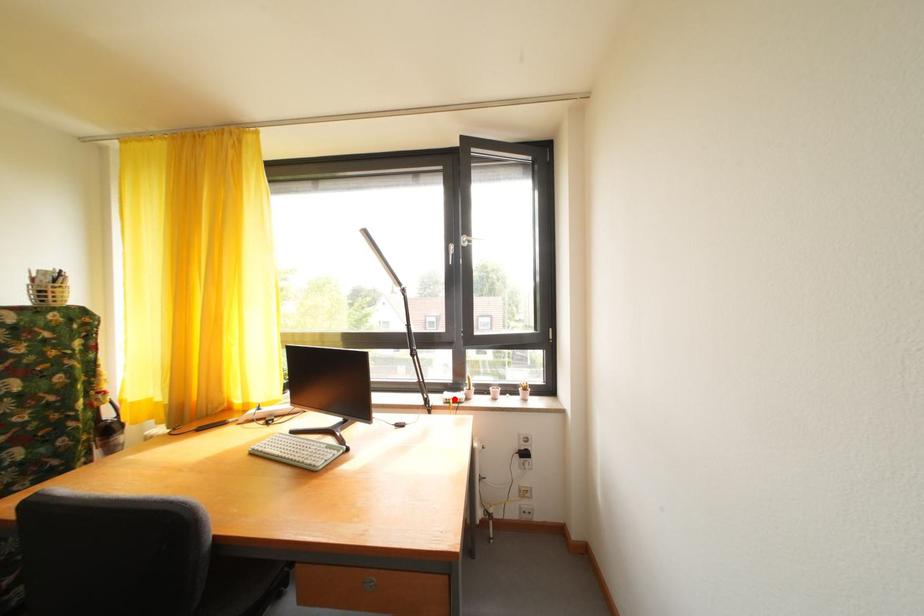
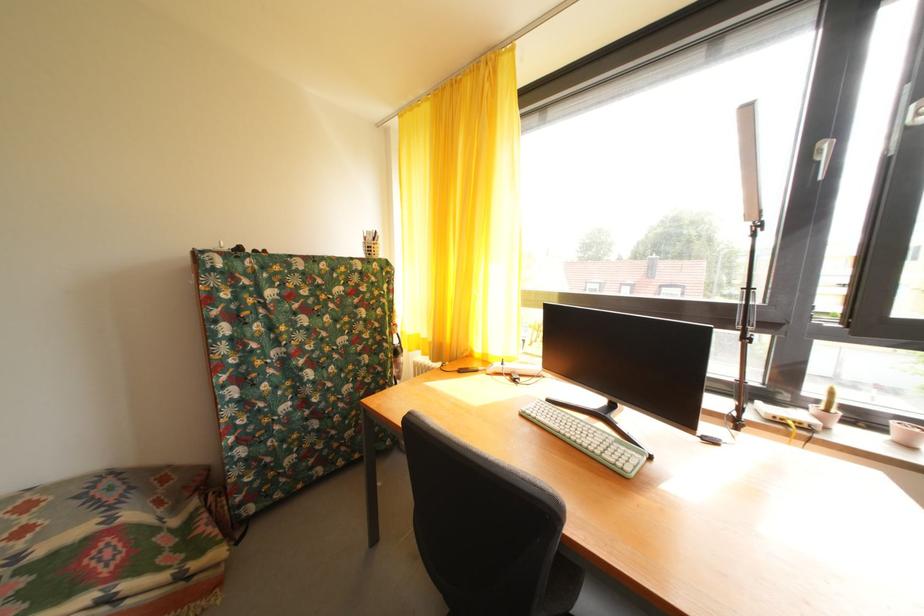
Where in the second image is the point corresponding to the highlighted location from the first image?

(768, 408)